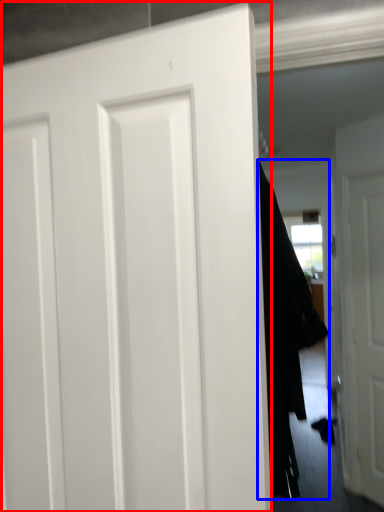
Question: Which of the following is the farthest to the observer, door (highlighted by a red box) or garment (highlighted by a blue box)?

Choices:
 (A) door
 (B) garment

Answer: (B)